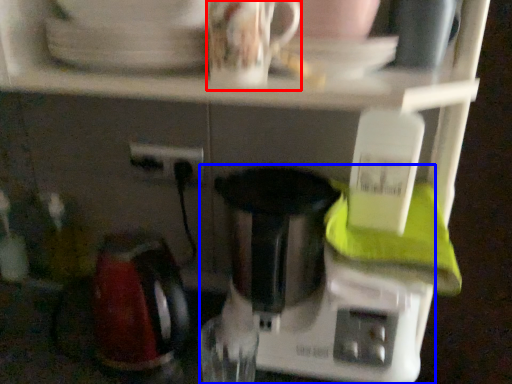
Question: Which object appears closest to the camera in this image, coffee cup (highlighted by a red box) or mixer (highlighted by a blue box)?

Choices:
 (A) coffee cup
 (B) mixer

Answer: (A)